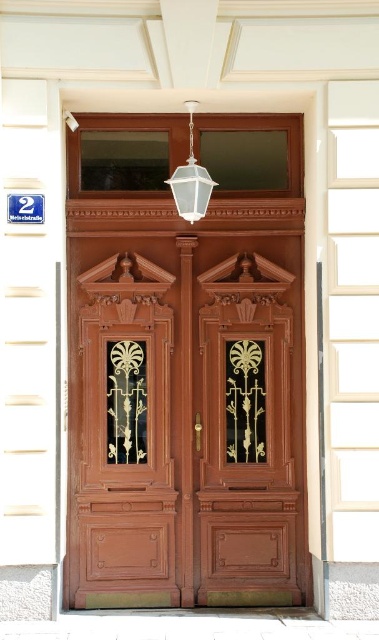
Question: Where is polished wood door at center located in relation to clear glass lantern at upper center in the image?

Choices:
 (A) right
 (B) left

Answer: (B)

Question: Among these points, which one is nearest to the camera?

Choices:
 (A) (189, 122)
 (B) (114, 358)

Answer: (A)

Question: Considering the real-world distances, which object is farthest from the matte wood door at center?

Choices:
 (A) clear glass lantern at upper center
 (B) polished wood door at center

Answer: (A)

Question: Can you confirm if matte wood door at center is positioned below clear glass lantern at upper center?

Choices:
 (A) yes
 (B) no

Answer: (A)

Question: Among these points, which one is farthest from the camera?

Choices:
 (A) (203, 470)
 (B) (208, 186)

Answer: (A)

Question: Can you confirm if matte wood door at center is positioned to the left of polished wood door at center?

Choices:
 (A) yes
 (B) no

Answer: (B)